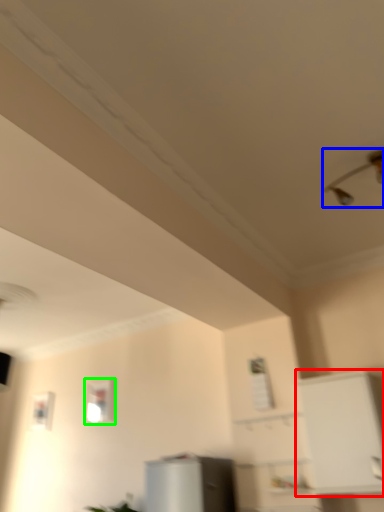
Question: Considering the real-world distances, which object is closest to cabinetry (highlighted by a red box)? light fixture (highlighted by a blue box) or window (highlighted by a green box).

Choices:
 (A) light fixture
 (B) window

Answer: (A)